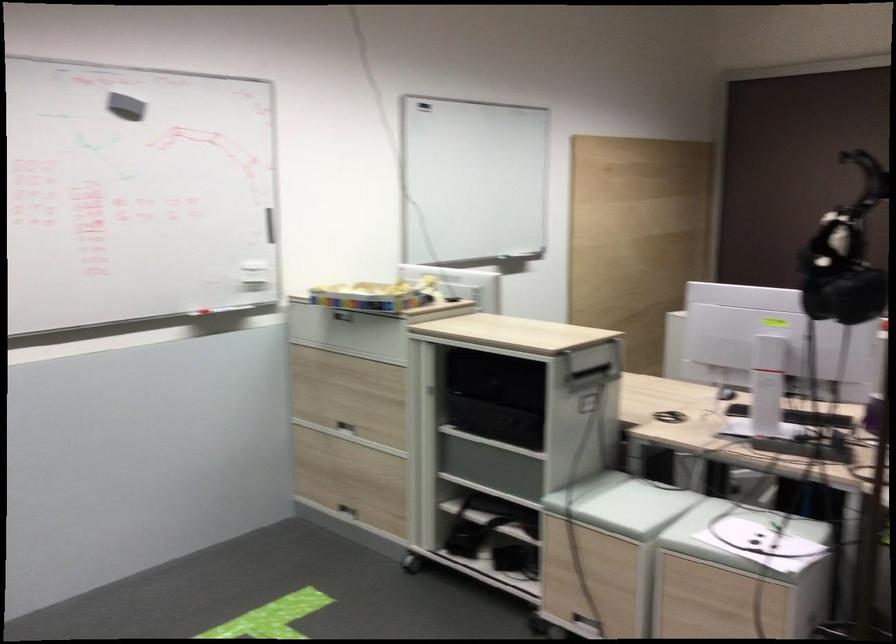
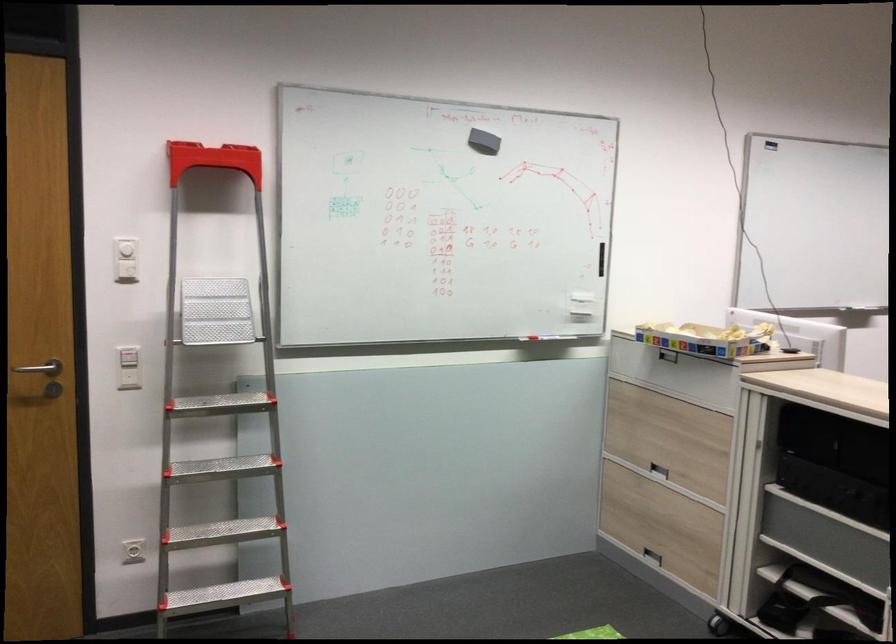
Where in the second image is the point corresponding to pixel 369 299 from the first image?

(705, 339)